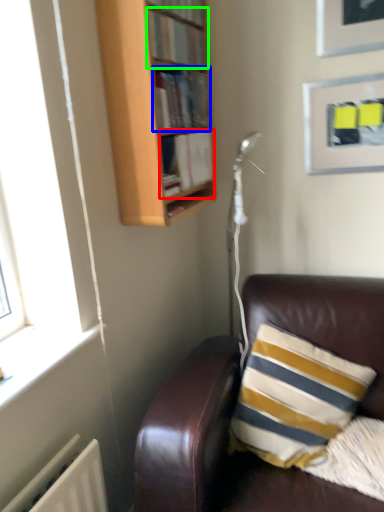
Question: Considering the real-world distances, which object is closest to book (highlighted by a red box)? book (highlighted by a blue box) or book (highlighted by a green box).

Choices:
 (A) book
 (B) book

Answer: (A)